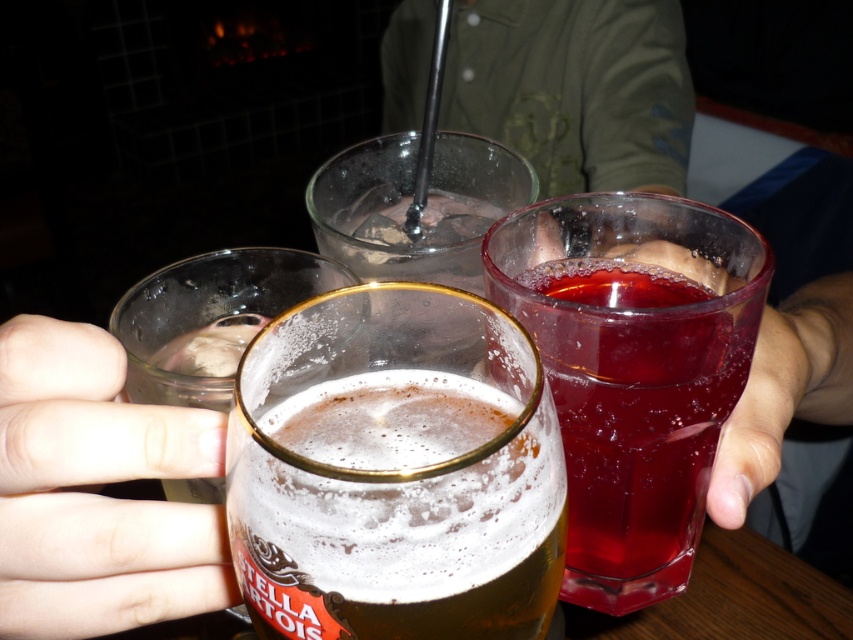
Which is behind, point (523, 570) or point (741, 467)?

The point (741, 467) is behind.

Is foamy golden beer at center to the left of clear plastic glass at lower right from the viewer's perspective?

Correct, you'll find foamy golden beer at center to the left of clear plastic glass at lower right.

In order to click on foamy golden beer at center in this screenshot , I will do `click(399, 513)`.

Can you confirm if foamy golden beer at center is bigger than white matte glass at lower left?

Indeed, foamy golden beer at center has a larger size compared to white matte glass at lower left.

Which is behind, point (361, 451) or point (219, 545)?

Point (219, 545)

Is point (381, 628) positioned in front of point (115, 432)?

Yes, it is in front of point (115, 432).

Find the location of a particular element. foamy golden beer at center is located at coordinates (399, 513).

Does white matte glass at lower left appear on the right side of clear glass at center?

No, white matte glass at lower left is not to the right of clear glass at center.

What do you see at coordinates (97, 492) in the screenshot? This screenshot has width=853, height=640. I see `white matte glass at lower left` at bounding box center [97, 492].

Is point (0, 358) positioned behind point (436, 208)?

No, it is in front of (436, 208).

Identify the location of white matte glass at lower left. pyautogui.click(x=97, y=492).